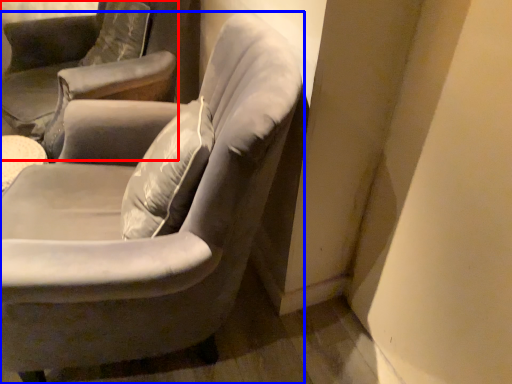
Question: Which object is further to the camera taking this photo, chair (highlighted by a red box) or chair (highlighted by a blue box)?

Choices:
 (A) chair
 (B) chair

Answer: (A)